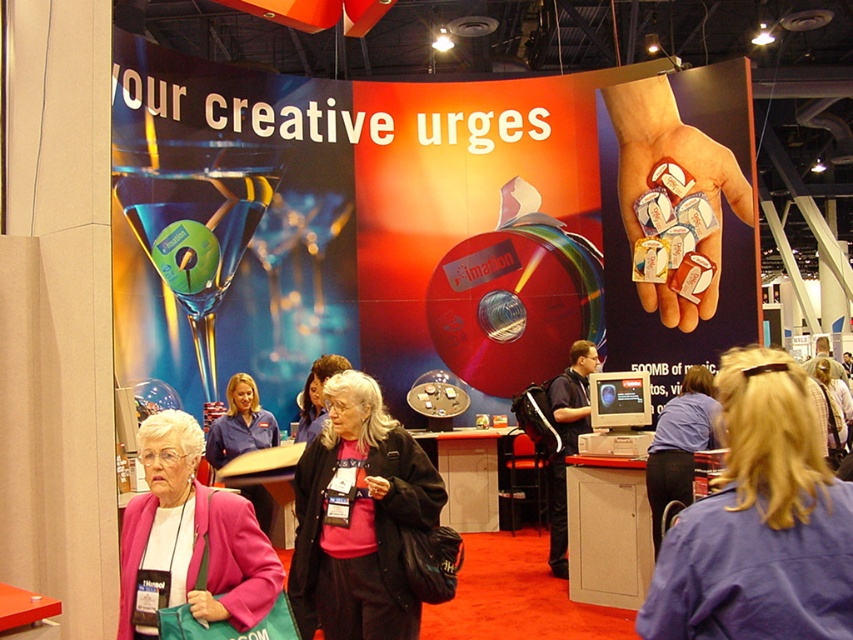
Question: Considering the relative positions of pink matte jacket at center and blue shirt at center in the image provided, where is pink matte jacket at center located with respect to blue shirt at center?

Choices:
 (A) left
 (B) right

Answer: (B)

Question: Does pink matte jacket at center have a larger size compared to white matte stickers at center?

Choices:
 (A) no
 (B) yes

Answer: (A)

Question: Which object appears farthest from the camera in this image?

Choices:
 (A) pink fabric jacket at lower left
 (B) blue shirt at center

Answer: (B)

Question: Among these objects, which one is farthest from the camera?

Choices:
 (A) blue shirt at center
 (B) white matte stickers at center

Answer: (B)

Question: Based on their relative distances, which object is farther from the blonde hair at upper right?

Choices:
 (A) blue shirt at center
 (B) pink fabric jacket at lower left
 (C) white matte stickers at center

Answer: (C)

Question: Is white matte stickers at center thinner than blue shirt at center?

Choices:
 (A) yes
 (B) no

Answer: (B)